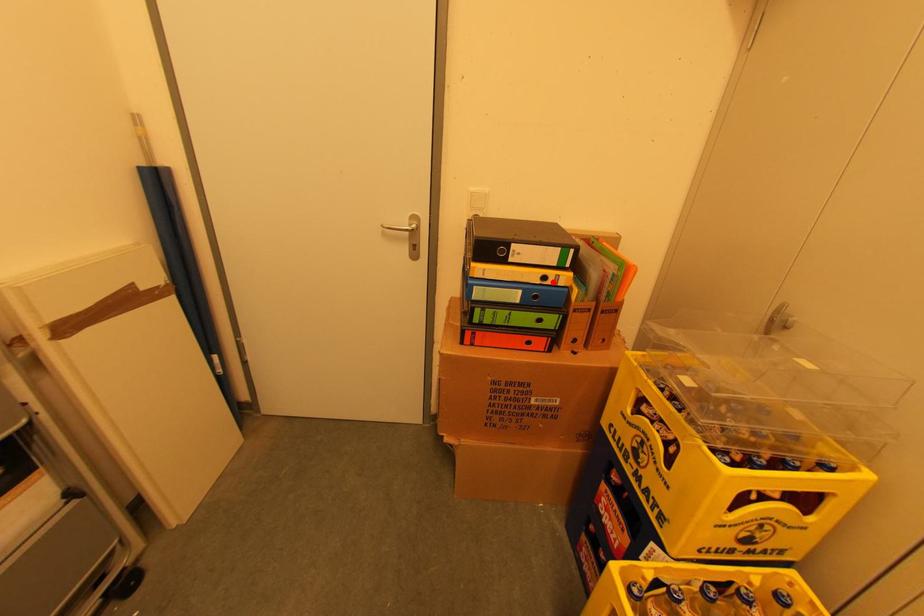
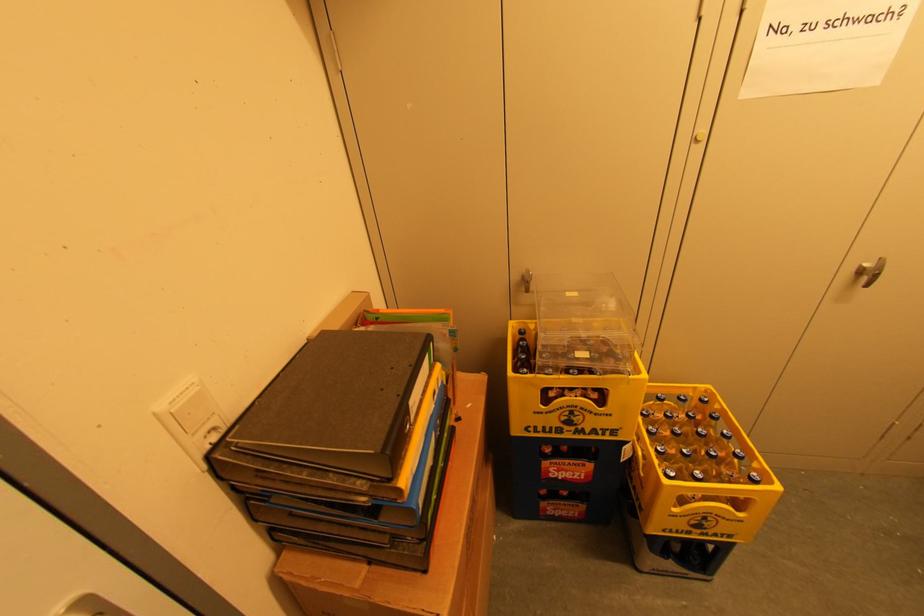
In the second image, find the point that corresponds to the highlighted location in the first image.

(440, 392)